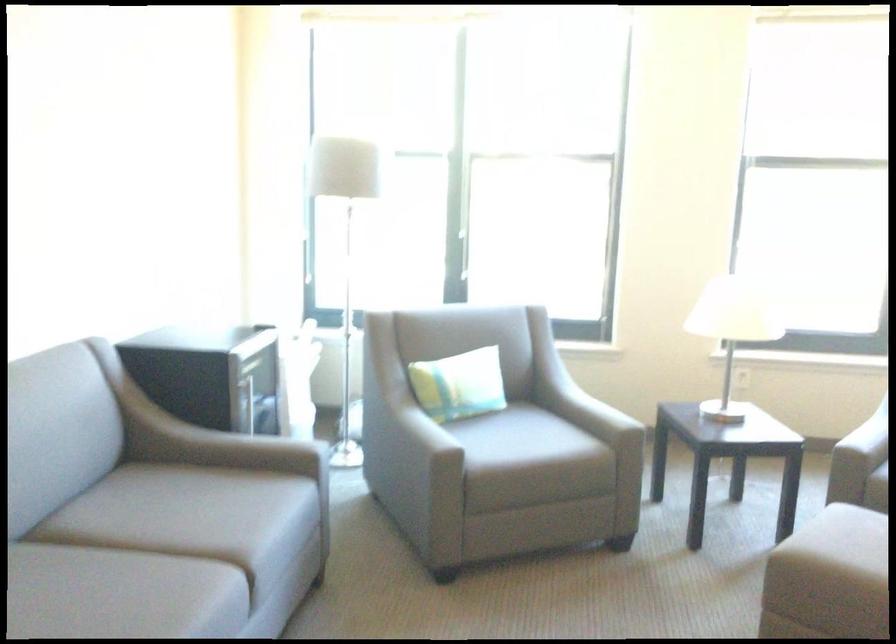
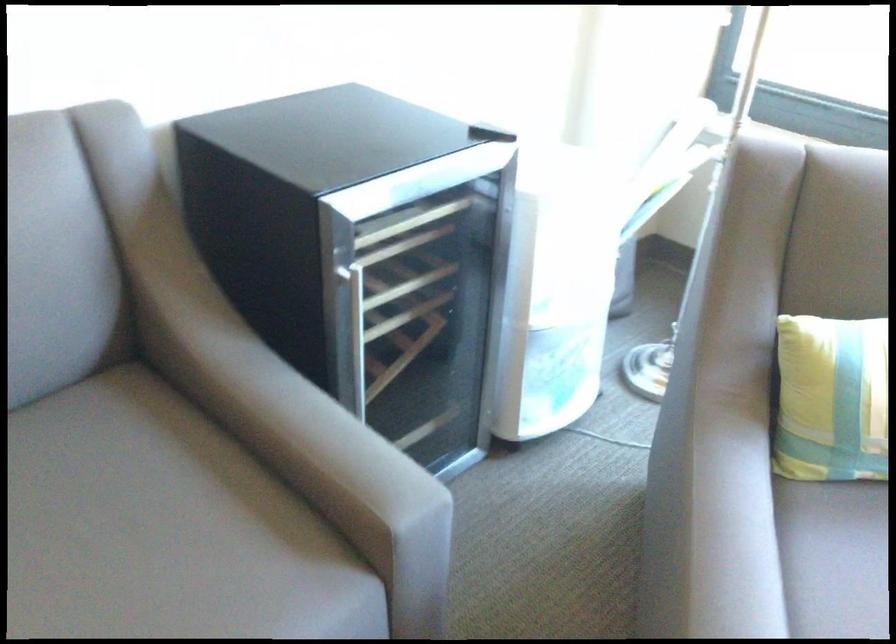
Locate, in the second image, the point that corresponds to point 383,433 in the first image.

(711, 522)